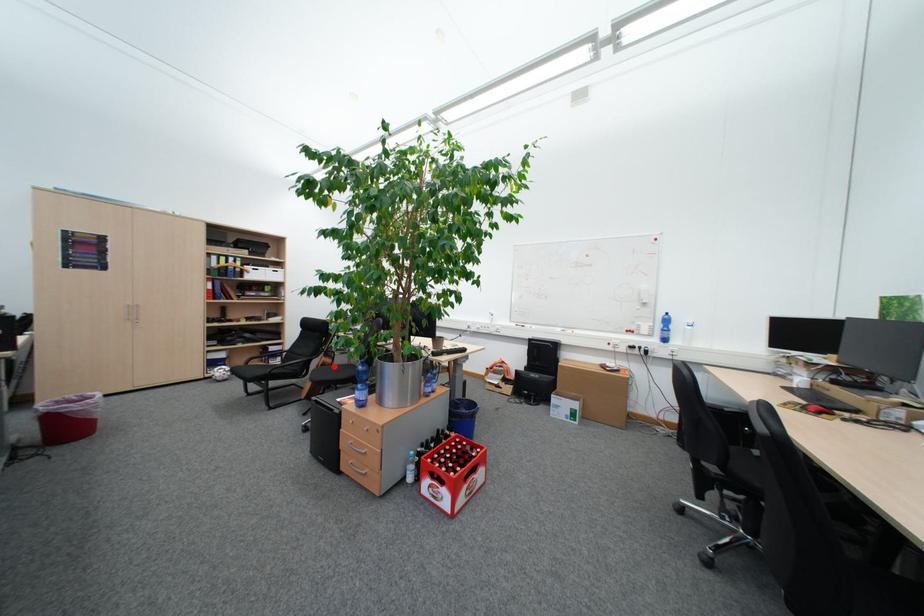
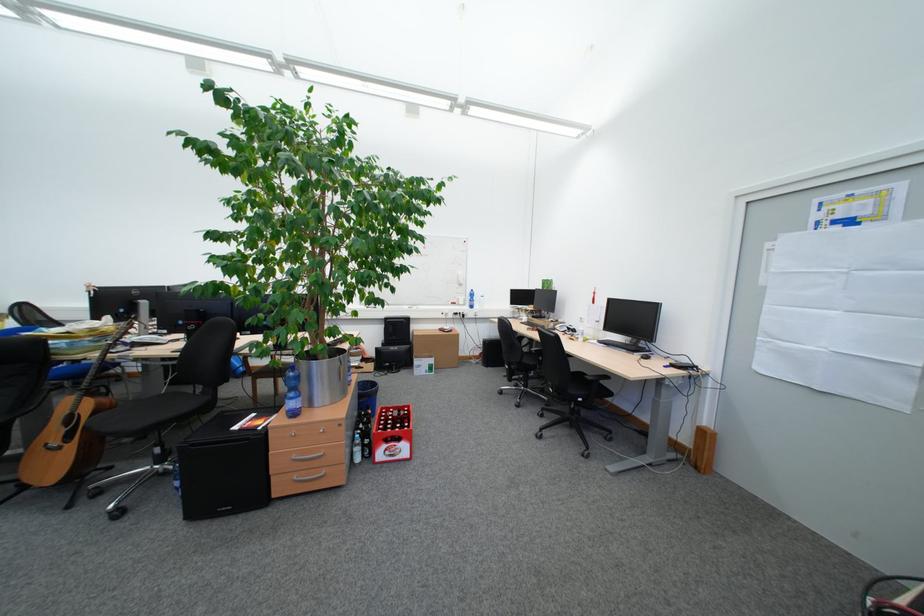
Question: I am providing you with two images of the same scene from different viewpoints. Image1 has a red point marked. In image2, the corresponding 3D location appears at what relative position? Reply with the corresponding letter.

Choices:
 (A) Closer
 (B) Farther

Answer: (A)